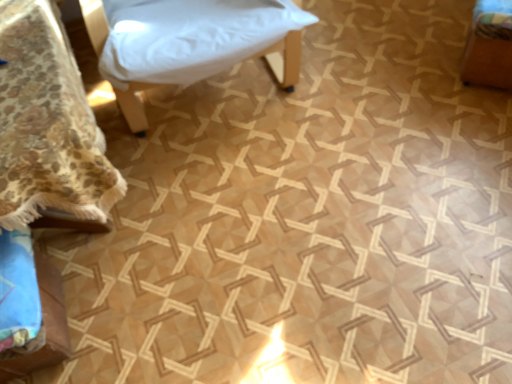
Question: From the image's perspective, is floral fabric bedspread at lower left, arranged as the fourth furniture when viewed from the right, under wooden box at right, acting as the 4th furniture starting from the left?

Choices:
 (A) no
 (B) yes

Answer: (B)

Question: Does floral fabric bedspread at lower left, arranged as the fourth furniture when viewed from the right, have a greater height compared to wooden box at right, which appears as the first furniture when viewed from the right?

Choices:
 (A) no
 (B) yes

Answer: (B)

Question: Does floral fabric bedspread at lower left, which ranks as the first furniture in left-to-right order, appear on the right side of wooden box at right, which appears as the first furniture when viewed from the right?

Choices:
 (A) no
 (B) yes

Answer: (A)

Question: From a real-world perspective, is floral fabric bedspread at lower left, which ranks as the first furniture in left-to-right order, on wooden box at right, acting as the 4th furniture starting from the left?

Choices:
 (A) yes
 (B) no

Answer: (A)

Question: Does floral fabric bedspread at lower left, arranged as the fourth furniture when viewed from the right, appear on the left side of wooden box at right, which appears as the first furniture when viewed from the right?

Choices:
 (A) yes
 (B) no

Answer: (A)

Question: Choose the correct answer: Is wooden box at right, acting as the 4th furniture starting from the left, inside blue fabric cushion at lower left, the 3th furniture from the right, or outside it?

Choices:
 (A) outside
 (B) inside

Answer: (A)

Question: Considering the positions of wooden box at right, which appears as the first furniture when viewed from the right, and blue fabric cushion at lower left, which is the 2th furniture from left to right, in the image, is wooden box at right, which appears as the first furniture when viewed from the right, bigger or smaller than blue fabric cushion at lower left, which is the 2th furniture from left to right,?

Choices:
 (A) small
 (B) big

Answer: (B)

Question: From the image's perspective, is wooden box at right, which appears as the first furniture when viewed from the right, above or below blue fabric cushion at lower left, which is the 2th furniture from left to right?

Choices:
 (A) above
 (B) below

Answer: (A)

Question: Based on their positions, is wooden box at right, which appears as the first furniture when viewed from the right, located to the left or right of blue fabric cushion at lower left, the 3th furniture from the right?

Choices:
 (A) right
 (B) left

Answer: (A)

Question: Considering their positions, is wooden box at right, which appears as the first furniture when viewed from the right, located in front of or behind white fabric cushion at upper center, acting as the third furniture starting from the left?

Choices:
 (A) behind
 (B) front

Answer: (A)

Question: Is wooden box at right, which appears as the first furniture when viewed from the right, situated inside white fabric cushion at upper center, acting as the third furniture starting from the left, or outside?

Choices:
 (A) outside
 (B) inside

Answer: (A)

Question: From a real-world perspective, is wooden box at right, which appears as the first furniture when viewed from the right, above or below white fabric cushion at upper center, which is counted as the second furniture, starting from the right?

Choices:
 (A) above
 (B) below

Answer: (B)

Question: Considering the relative positions of wooden box at right, which appears as the first furniture when viewed from the right, and white fabric cushion at upper center, acting as the third furniture starting from the left, in the image provided, is wooden box at right, which appears as the first furniture when viewed from the right, to the left or to the right of white fabric cushion at upper center, acting as the third furniture starting from the left,?

Choices:
 (A) right
 (B) left

Answer: (A)

Question: Considering the relative positions of white fabric cushion at upper center, which is counted as the second furniture, starting from the right, and floral fabric bedspread at lower left, arranged as the fourth furniture when viewed from the right, in the image provided, is white fabric cushion at upper center, which is counted as the second furniture, starting from the right, to the left or to the right of floral fabric bedspread at lower left, arranged as the fourth furniture when viewed from the right,?

Choices:
 (A) left
 (B) right

Answer: (B)

Question: From a real-world perspective, is white fabric cushion at upper center, acting as the third furniture starting from the left, above or below floral fabric bedspread at lower left, which ranks as the first furniture in left-to-right order?

Choices:
 (A) below
 (B) above

Answer: (B)